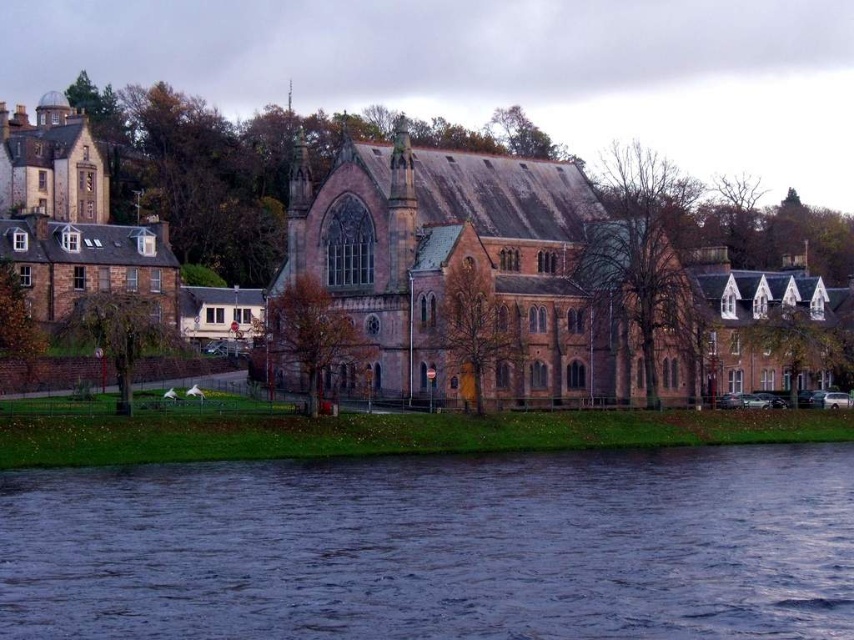
You are planning to build a small wooden dock for fishing. The dock needs to be 10 meters long. You have to decide whether the space between the dark blue water at lower center and the brown stone church at center is sufficient. Based on the scene description, can the dock be placed there?

The dark blue water at lower center might be wider than the brown stone church at center. Since the dock requires 10 meters, and the width of the water isn answer is uncertain, it is possible that the space is sufficient. However, without exact measurements, it is recommended to verify the actual width before proceeding.

You are standing on the grassy area in front of the brown stone church at center. If you look down towards the dark blue water at lower center, in which direction relative to the church would you see the water?

The dark blue water at lower center is below the brown stone church at center, so looking down towards the lower part of the scene, you would see the water directly beneath the church.

You are standing on the riverbank and want to walk to the brown stone church at center. The path you need to take is directly in front of the dark blue water at lower center. If your walking speed is 3 feet per second, how many seconds will it take you to reach the church?

Answer: The distance between the dark blue water at lower center and the brown stone church at center is 68.20 feet. At a walking speed of 3 feet per second, dividing the distance by the speed gives 68.20 divided by 3 equals approximately 22.73 seconds. Therefore, it will take about 22.73 seconds to reach the church.